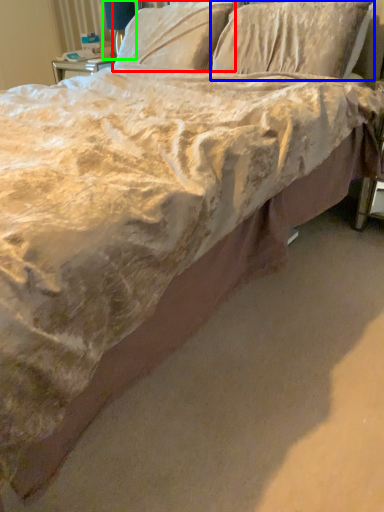
Question: Which object is the farthest from pillow (highlighted by a red box)? Choose among these: pillow (highlighted by a blue box) or table lamp (highlighted by a green box).

Choices:
 (A) pillow
 (B) table lamp

Answer: (B)